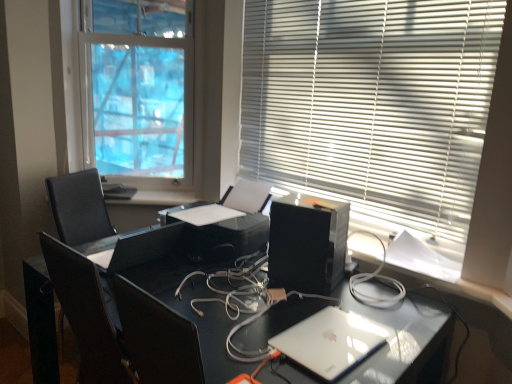
Where is `vacant space situated above white glossy window sill at center (from a real-world perspective)`? This screenshot has height=384, width=512. vacant space situated above white glossy window sill at center (from a real-world perspective) is located at coordinates (145, 193).